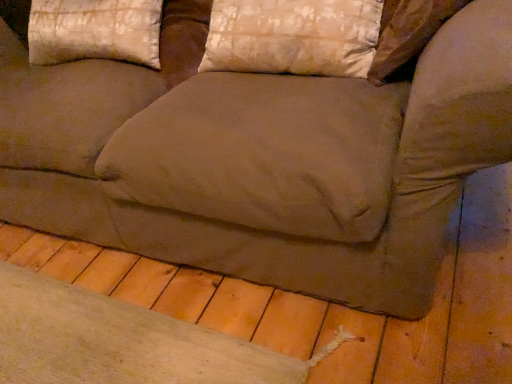
The image size is (512, 384). What are the coordinates of `silky beige pillow at upper center, positioned as the first pillow in right-to-left order` in the screenshot? It's located at (293, 37).

This screenshot has width=512, height=384. What do you see at coordinates (293, 37) in the screenshot?
I see `silky beige pillow at upper center, which is the second pillow from left to right` at bounding box center [293, 37].

Identify the location of silky beige pillow at upper left, arranged as the 2th pillow when viewed from the right. (94, 31).

What do you see at coordinates (94, 31) in the screenshot?
I see `silky beige pillow at upper left, arranged as the 2th pillow when viewed from the right` at bounding box center [94, 31].

Find the location of a particular element. This screenshot has height=384, width=512. silky beige pillow at upper center, positioned as the first pillow in right-to-left order is located at coordinates (293, 37).

In the scene shown: Visually, is silky beige pillow at upper center, which is the second pillow from left to right, positioned to the left or to the right of silky beige pillow at upper left, positioned as the 1th pillow in left-to-right order?

silky beige pillow at upper center, which is the second pillow from left to right, is to the right of silky beige pillow at upper left, positioned as the 1th pillow in left-to-right order.

From the picture: Is silky beige pillow at upper center, positioned as the first pillow in right-to-left order, behind silky beige pillow at upper left, arranged as the 2th pillow when viewed from the right?

No, it is not.

Does point (254, 10) come closer to viewer compared to point (34, 9)?

Yes, it is.

From the image's perspective, which one is positioned lower, silky beige pillow at upper center, which is the second pillow from left to right, or silky beige pillow at upper left, arranged as the 2th pillow when viewed from the right?

silky beige pillow at upper center, which is the second pillow from left to right, appears lower in the image.

From a real-world perspective, who is located higher, silky beige pillow at upper center, positioned as the first pillow in right-to-left order, or silky beige pillow at upper left, positioned as the 1th pillow in left-to-right order?

In real-world perspective, silky beige pillow at upper left, positioned as the 1th pillow in left-to-right order, is above.

Which object is wider, silky beige pillow at upper center, positioned as the first pillow in right-to-left order, or silky beige pillow at upper left, positioned as the 1th pillow in left-to-right order?

Wider between the two is silky beige pillow at upper left, positioned as the 1th pillow in left-to-right order.

Between silky beige pillow at upper center, which is the second pillow from left to right, and silky beige pillow at upper left, positioned as the 1th pillow in left-to-right order, which one has less height?

With less height is silky beige pillow at upper center, which is the second pillow from left to right.

Consider the image. Does silky beige pillow at upper center, positioned as the first pillow in right-to-left order, have a larger size compared to silky beige pillow at upper left, positioned as the 1th pillow in left-to-right order?

Incorrect, silky beige pillow at upper center, positioned as the first pillow in right-to-left order, is not larger than silky beige pillow at upper left, positioned as the 1th pillow in left-to-right order.

Choose the correct answer: Is silky beige pillow at upper center, which is the second pillow from left to right, inside silky beige pillow at upper left, positioned as the 1th pillow in left-to-right order, or outside it?

silky beige pillow at upper center, which is the second pillow from left to right, lies outside silky beige pillow at upper left, positioned as the 1th pillow in left-to-right order.

Would you say silky beige pillow at upper center, positioned as the first pillow in right-to-left order, is a long distance from silky beige pillow at upper left, arranged as the 2th pillow when viewed from the right?

They are positioned close to each other.

Based on the photo, does silky beige pillow at upper center, positioned as the first pillow in right-to-left order, turn towards silky beige pillow at upper left, arranged as the 2th pillow when viewed from the right?

No, silky beige pillow at upper center, positioned as the first pillow in right-to-left order, is not oriented towards silky beige pillow at upper left, arranged as the 2th pillow when viewed from the right.

Can you tell me how much silky beige pillow at upper center, positioned as the first pillow in right-to-left order, and silky beige pillow at upper left, positioned as the 1th pillow in left-to-right order, differ in facing direction?

silky beige pillow at upper center, positioned as the first pillow in right-to-left order, and silky beige pillow at upper left, positioned as the 1th pillow in left-to-right order, are facing 0.000433 degrees away from each other.

How much distance is there between silky beige pillow at upper center, positioned as the first pillow in right-to-left order, and silky beige pillow at upper left, arranged as the 2th pillow when viewed from the right?

19.21 inches.

Where is `pillow on the right of silky beige pillow at upper left, positioned as the 1th pillow in left-to-right order`? pillow on the right of silky beige pillow at upper left, positioned as the 1th pillow in left-to-right order is located at coordinates (293, 37).

Which object is positioned more to the left, silky beige pillow at upper left, positioned as the 1th pillow in left-to-right order, or silky beige pillow at upper center, which is the second pillow from left to right?

Positioned to the left is silky beige pillow at upper left, positioned as the 1th pillow in left-to-right order.

Consider the image. Is the position of silky beige pillow at upper left, positioned as the 1th pillow in left-to-right order, more distant than that of silky beige pillow at upper center, positioned as the first pillow in right-to-left order?

Yes, silky beige pillow at upper left, positioned as the 1th pillow in left-to-right order, is behind silky beige pillow at upper center, positioned as the first pillow in right-to-left order.

Between point (118, 25) and point (339, 4), which one is positioned behind?

The point (118, 25) is behind.

From the image's perspective, does silky beige pillow at upper left, positioned as the 1th pillow in left-to-right order, appear lower than silky beige pillow at upper center, which is the second pillow from left to right?

No, from the image's perspective, silky beige pillow at upper left, positioned as the 1th pillow in left-to-right order, is not beneath silky beige pillow at upper center, which is the second pillow from left to right.

From the picture: From a real-world perspective, is silky beige pillow at upper left, arranged as the 2th pillow when viewed from the right, positioned above or below silky beige pillow at upper center, which is the second pillow from left to right?

Clearly, from a real-world perspective, silky beige pillow at upper left, arranged as the 2th pillow when viewed from the right, is above silky beige pillow at upper center, which is the second pillow from left to right.

Considering the sizes of objects silky beige pillow at upper left, positioned as the 1th pillow in left-to-right order, and silky beige pillow at upper center, positioned as the first pillow in right-to-left order, in the image provided, who is thinner, silky beige pillow at upper left, positioned as the 1th pillow in left-to-right order, or silky beige pillow at upper center, positioned as the first pillow in right-to-left order,?

Thinner between the two is silky beige pillow at upper center, positioned as the first pillow in right-to-left order.

Is silky beige pillow at upper left, positioned as the 1th pillow in left-to-right order, taller than silky beige pillow at upper center, positioned as the first pillow in right-to-left order?

Correct, silky beige pillow at upper left, positioned as the 1th pillow in left-to-right order, is much taller as silky beige pillow at upper center, positioned as the first pillow in right-to-left order.

Considering the sizes of objects silky beige pillow at upper left, positioned as the 1th pillow in left-to-right order, and silky beige pillow at upper center, which is the second pillow from left to right, in the image provided, who is smaller, silky beige pillow at upper left, positioned as the 1th pillow in left-to-right order, or silky beige pillow at upper center, which is the second pillow from left to right,?

silky beige pillow at upper center, which is the second pillow from left to right, is smaller.

Is silky beige pillow at upper left, positioned as the 1th pillow in left-to-right order, completely or partially outside of silky beige pillow at upper center, positioned as the first pillow in right-to-left order?

silky beige pillow at upper left, positioned as the 1th pillow in left-to-right order, lies outside silky beige pillow at upper center, positioned as the first pillow in right-to-left order,'s area.

Is silky beige pillow at upper left, positioned as the 1th pillow in left-to-right order, far from silky beige pillow at upper center, which is the second pillow from left to right?

They are positioned close to each other.

Is silky beige pillow at upper left, positioned as the 1th pillow in left-to-right order, aimed at silky beige pillow at upper center, which is the second pillow from left to right?

No, silky beige pillow at upper left, positioned as the 1th pillow in left-to-right order, is not aimed at silky beige pillow at upper center, which is the second pillow from left to right.

Measure the distance from silky beige pillow at upper left, positioned as the 1th pillow in left-to-right order, to silky beige pillow at upper center, positioned as the first pillow in right-to-left order.

silky beige pillow at upper left, positioned as the 1th pillow in left-to-right order, and silky beige pillow at upper center, positioned as the first pillow in right-to-left order, are 19.21 inches apart.

Where is `pillow on the right of silky beige pillow at upper left, positioned as the 1th pillow in left-to-right order`? pillow on the right of silky beige pillow at upper left, positioned as the 1th pillow in left-to-right order is located at coordinates (293, 37).

Where is `pillow on the right of silky beige pillow at upper left, positioned as the 1th pillow in left-to-right order`? This screenshot has height=384, width=512. pillow on the right of silky beige pillow at upper left, positioned as the 1th pillow in left-to-right order is located at coordinates (293, 37).

Find the location of a particular element. This screenshot has height=384, width=512. pillow in front of the silky beige pillow at upper left, positioned as the 1th pillow in left-to-right order is located at coordinates point(293,37).